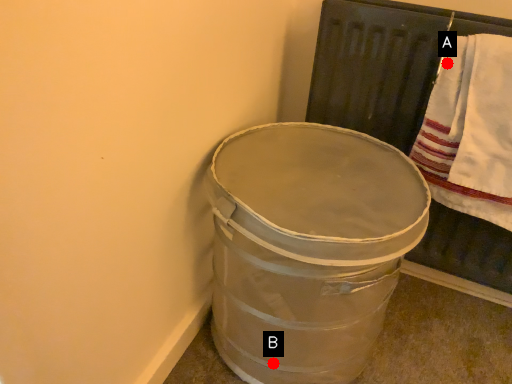
Question: Two points are circled on the image, labeled by A and B beside each circle. Which point is closer to the camera?

Choices:
 (A) A is closer
 (B) B is closer

Answer: (A)